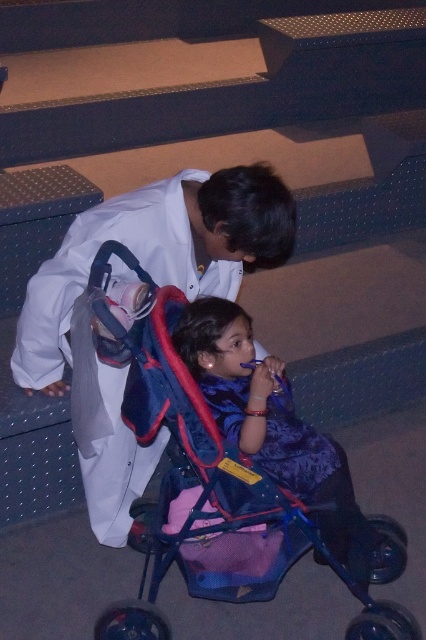
Can you confirm if white matte coat at upper left is wider than blue fabric stroller at lower center?

Yes, white matte coat at upper left is wider than blue fabric stroller at lower center.

Who is taller, white matte coat at upper left or blue fabric stroller at lower center?

Standing taller between the two is white matte coat at upper left.

Is point (135, 472) more distant than point (276, 420)?

Yes, it is behind point (276, 420).

Where is `white matte coat at upper left`? The image size is (426, 640). white matte coat at upper left is located at coordinates (157, 284).

Who is higher up, blue plastic baby carriage at center or blue fabric stroller at lower center?

blue fabric stroller at lower center is above.

Does blue plastic baby carriage at center have a smaller size compared to blue fabric stroller at lower center?

Actually, blue plastic baby carriage at center might be larger than blue fabric stroller at lower center.

The height and width of the screenshot is (640, 426). Identify the location of blue plastic baby carriage at center. (219, 461).

Locate an element on the screen. The image size is (426, 640). blue plastic baby carriage at center is located at coordinates (219, 461).

Who is lower down, white matte coat at upper left or blue plastic baby carriage at center?

blue plastic baby carriage at center is lower down.

What do you see at coordinates (157, 284) in the screenshot?
I see `white matte coat at upper left` at bounding box center [157, 284].

Which is in front, point (92, 352) or point (94, 259)?

Point (94, 259) is more forward.

The width and height of the screenshot is (426, 640). I want to click on white matte coat at upper left, so click(x=157, y=284).